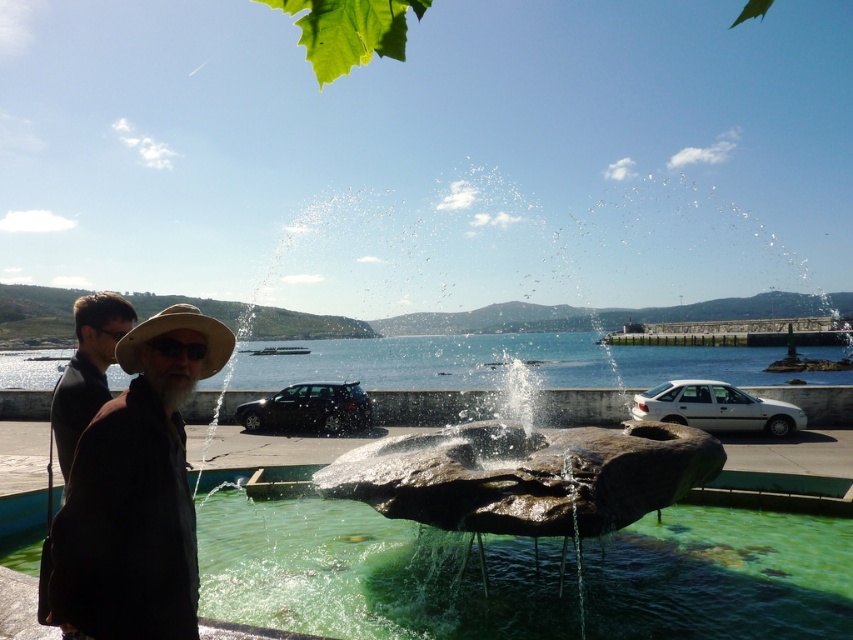
Who is positioned more to the left, green stone water at center or dark brown leather jacket at left?

From the viewer's perspective, dark brown leather jacket at left appears more on the left side.

Can you confirm if green stone water at center is shorter than dark brown leather jacket at left?

Yes, green stone water at center is shorter than dark brown leather jacket at left.

Where is `green stone water at center`? Image resolution: width=853 pixels, height=640 pixels. green stone water at center is located at coordinates (370, 572).

Who is taller, green stone water at center or natural straw cowboy hat at center?

natural straw cowboy hat at center

Locate an element on the screen. green stone water at center is located at coordinates (370, 572).

The width and height of the screenshot is (853, 640). Describe the element at coordinates (370, 572) in the screenshot. I see `green stone water at center` at that location.

You are a GUI agent. You are given a task and a screenshot of the screen. Output one action in this format:
    pyautogui.click(x=<x>, y=<y>)
    Task: Click on the green stone water at center
    This screenshot has height=640, width=853.
    Given the screenshot: What is the action you would take?
    pyautogui.click(x=370, y=572)

Can you confirm if brown leather jacket at left is positioned to the left of dark brown leather jacket at left?

Incorrect, brown leather jacket at left is not on the left side of dark brown leather jacket at left.

Which is in front, point (190, 554) or point (97, 403)?

Positioned in front is point (190, 554).

I want to click on brown leather jacket at left, so click(136, 492).